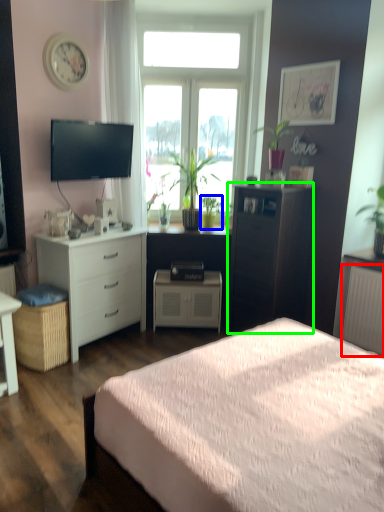
Question: Based on their relative distances, which object is nearer to radiator (highlighted by a red box)? Choose from houseplant (highlighted by a blue box) and chest of drawers (highlighted by a green box).

Choices:
 (A) houseplant
 (B) chest of drawers

Answer: (B)